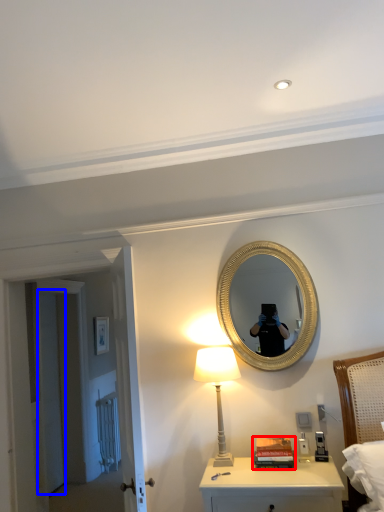
Question: Which of the following is the farthest to the observer, book (highlighted by a red box) or door (highlighted by a blue box)?

Choices:
 (A) book
 (B) door

Answer: (B)